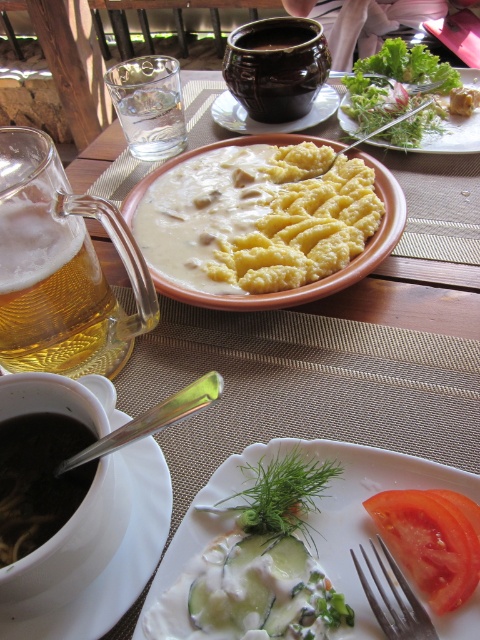
Question: Does yellow matte polenta at center appear on the right side of foamy golden beer at left?

Choices:
 (A) no
 (B) yes

Answer: (B)

Question: Which point appears closest to the camera in this image?

Choices:
 (A) (330, 104)
 (B) (328, 168)

Answer: (B)

Question: Which point is farther to the camera?

Choices:
 (A) (276, 35)
 (B) (36, 312)
 (C) (450, 86)
 (D) (274, 77)

Answer: (A)

Question: Does black matte soup at lower left have a smaller size compared to brown matte pot at upper center?

Choices:
 (A) no
 (B) yes

Answer: (A)

Question: Which is farther from the white creamy cucumber at lower center?

Choices:
 (A) matte ceramic bowl at center
 (B) white ceramic bowl at upper center
 (C) yellow matte polenta at center
 (D) red smooth tomato at lower right

Answer: (A)

Question: Is white ceramic bowl at upper center thinner than red smooth tomato at lower right?

Choices:
 (A) no
 (B) yes

Answer: (A)